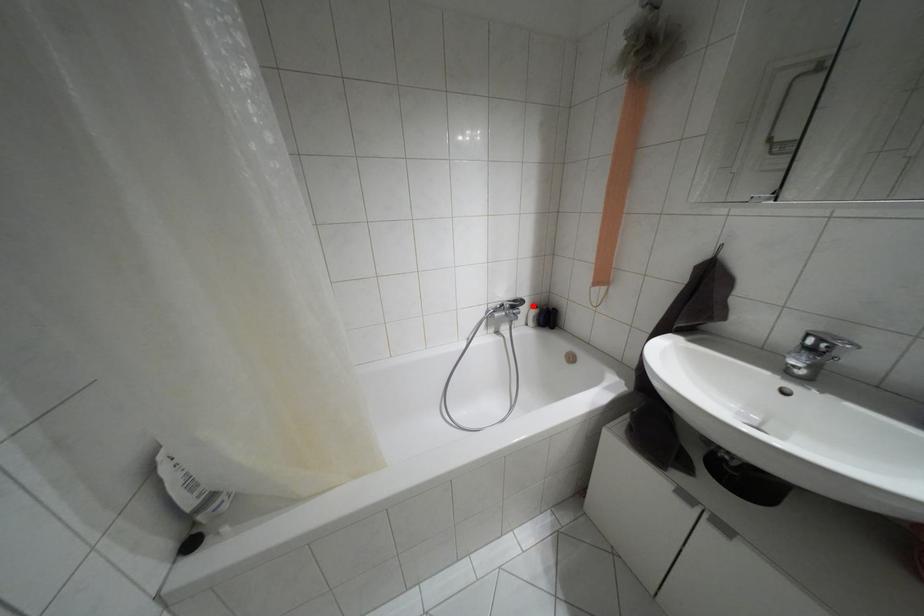
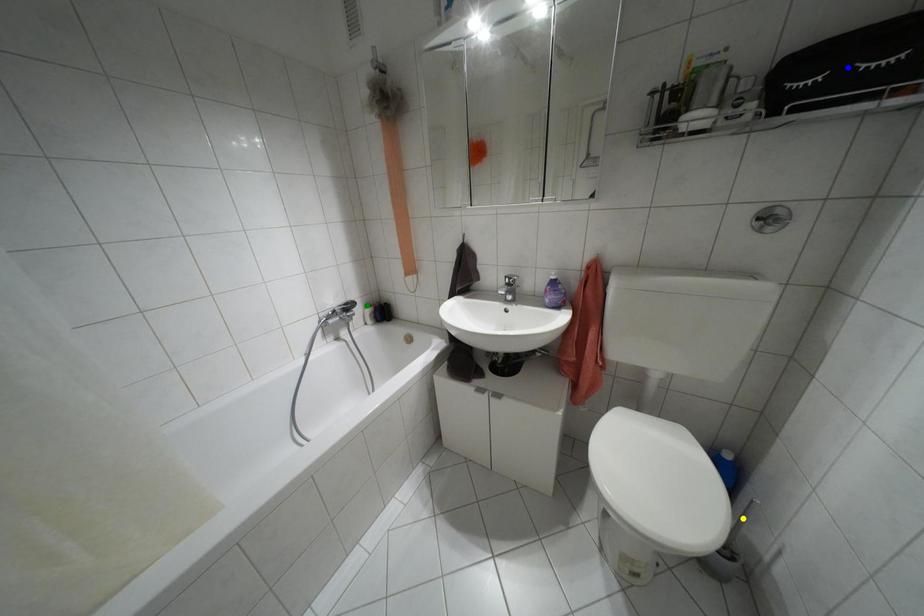
Question: I am providing you with two images of the same scene from different viewpoints. A red point is marked on the first image. You are given multiple points on the second image. In image 2, which mark is for the same physical point as the one in image 1?

Choices:
 (A) blue point
 (B) yellow point
 (C) green point

Answer: (C)